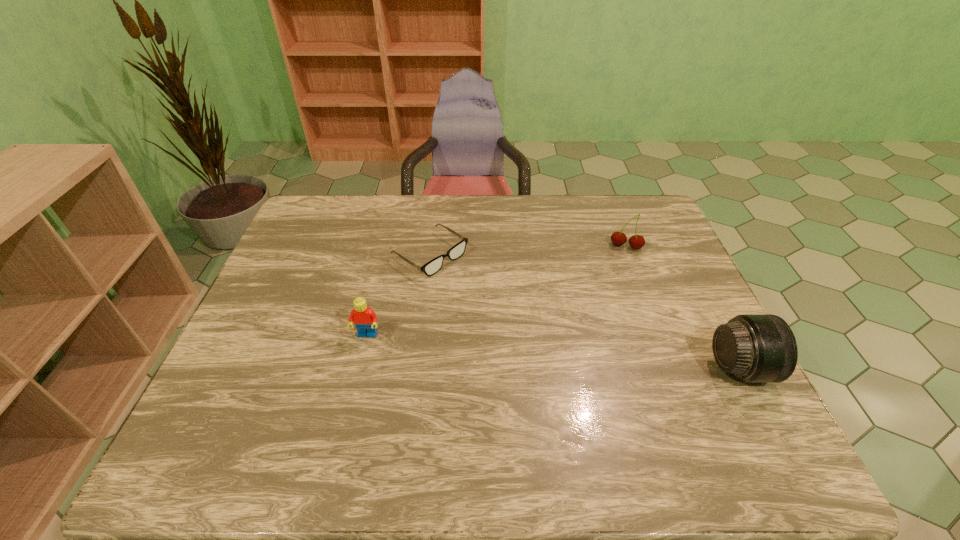
This screenshot has height=540, width=960. In order to click on free location located 0.090m on the front-facing side of the shortest object in this screenshot , I will do `click(479, 287)`.

Locate an element on the screen. This screenshot has height=540, width=960. free point located 0.190m on the front-facing side of the shortest object is located at coordinates (506, 304).

Identify the location of object at the far edge. Image resolution: width=960 pixels, height=540 pixels. (433, 266).

This screenshot has height=540, width=960. I want to click on object that is positioned at the near edge, so (755, 348).

This screenshot has height=540, width=960. Identify the location of telephoto lens at the right edge. (755, 348).

This screenshot has height=540, width=960. I want to click on cherry situated at the right edge, so click(636, 241).

At what (x,y) coordinates should I click in order to perform the action: click on object present at the near right corner. Please return your answer as a coordinate pair (x, y). Looking at the image, I should click on (755, 348).

Locate an element on the screen. free space at the far edge is located at coordinates (364, 207).

Find the location of `free space at the near edge of the desktop`. free space at the near edge of the desktop is located at coordinates (640, 390).

Where is `free point at the left edge`? The width and height of the screenshot is (960, 540). free point at the left edge is located at coordinates (253, 342).